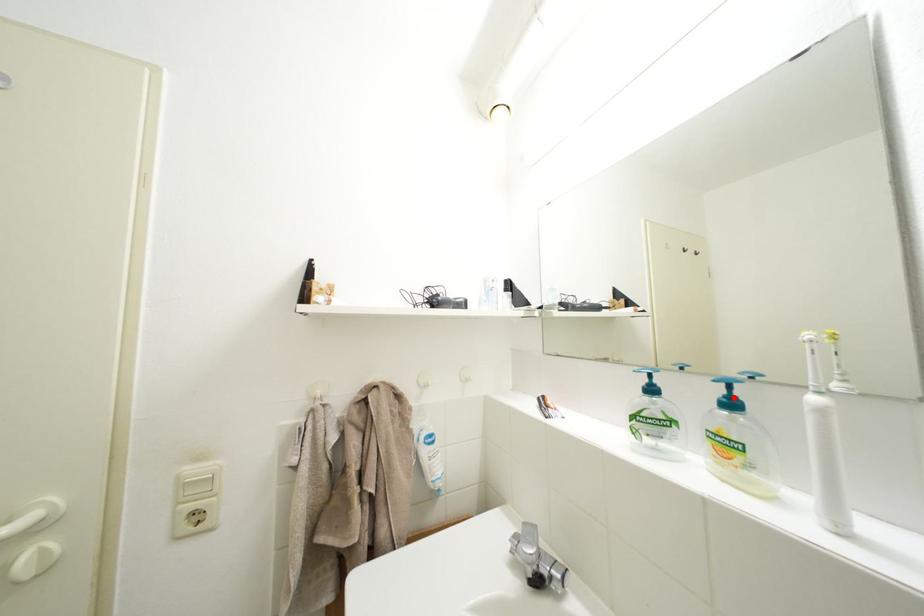
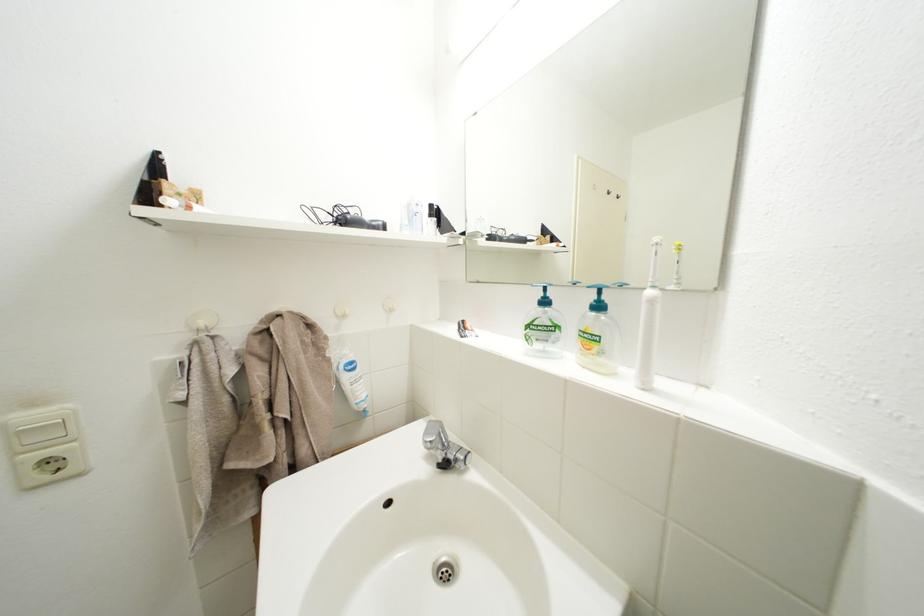
In the second image, find the point that corresponds to the highlighted location in the first image.

(604, 302)